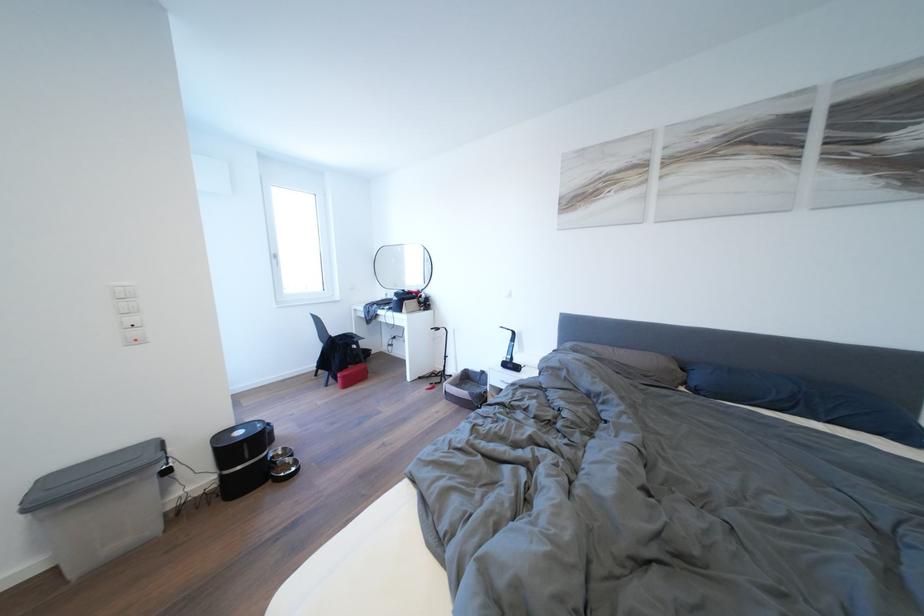
Where is `blue pillow`? blue pillow is located at coordinates (806, 400).